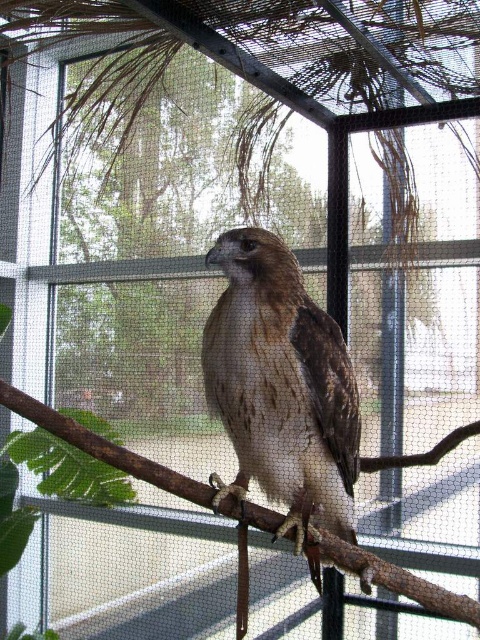
Question: Does brown feathered eagle at center appear on the right side of brown wood tree branch at center?

Choices:
 (A) yes
 (B) no

Answer: (A)

Question: Observing the image, what is the correct spatial positioning of brown feathered eagle at center in reference to brown wood tree branch at center?

Choices:
 (A) below
 (B) above

Answer: (B)

Question: Which point is farther to the camera?

Choices:
 (A) (x=243, y=371)
 (B) (x=364, y=557)

Answer: (B)

Question: Which point is closer to the camera taking this photo?

Choices:
 (A) (313, 317)
 (B) (82, 429)

Answer: (B)

Question: Where is brown feathered eagle at center located in relation to brown wood tree branch at center in the image?

Choices:
 (A) below
 (B) above

Answer: (B)